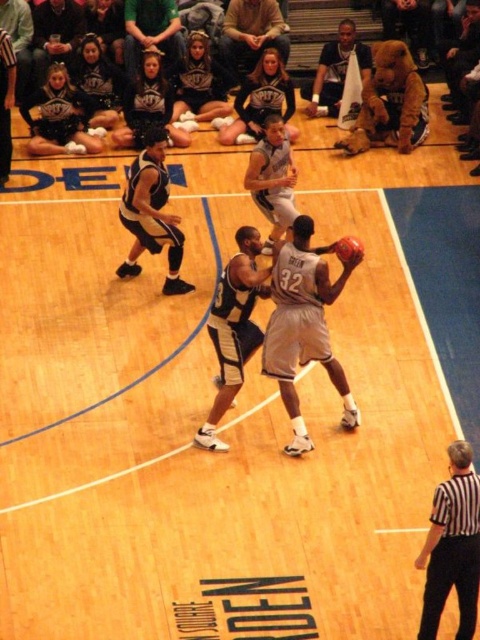
You are a spectator at the game and want to take a photo of both the green jersey at upper center and the matte black basketball at center. Which object should you zoom in on to ensure both are clearly visible in the frame?

The green jersey at upper center is larger in size than the matte black basketball at center, so you should zoom in on the green jersey at upper center to ensure both are clearly visible in the frame.